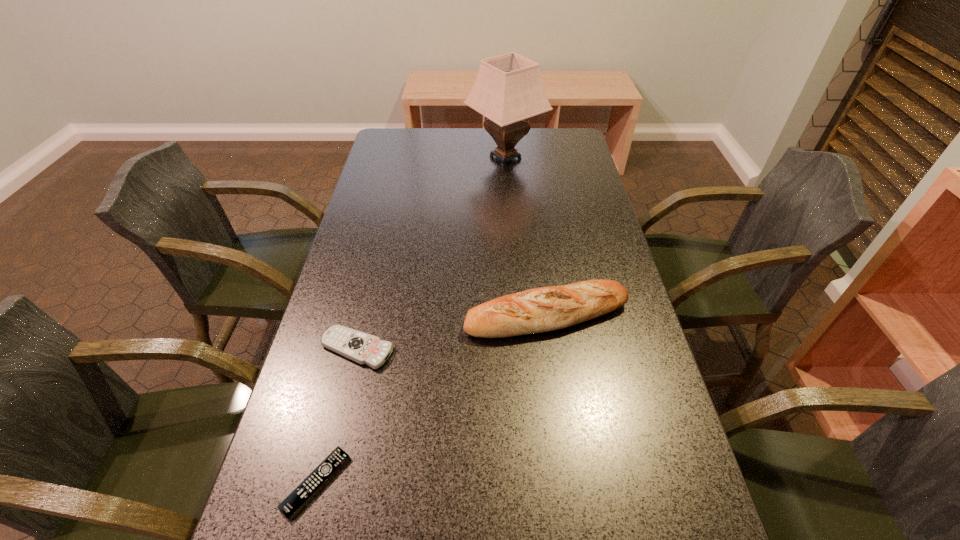
Find the location of a particular element. the farthest object is located at coordinates (508, 89).

Image resolution: width=960 pixels, height=540 pixels. Identify the location of the tallest object. (508, 89).

The height and width of the screenshot is (540, 960). Find the location of `baguet`. baguet is located at coordinates (537, 310).

You are a GUI agent. You are given a task and a screenshot of the screen. Output one action in this format:
    pyautogui.click(x=<x>, y=<y>)
    Task: Click on the second shortest object
    Image resolution: width=960 pixels, height=540 pixels.
    Given the screenshot: What is the action you would take?
    pyautogui.click(x=363, y=348)

Image resolution: width=960 pixels, height=540 pixels. What are the coordinates of `the taller remote control` in the screenshot? It's located at (363, 348).

Locate an element on the screen. The image size is (960, 540). the shortest object is located at coordinates (313, 483).

Locate an element on the screen. The width and height of the screenshot is (960, 540). the shorter remote control is located at coordinates (313, 483).

The height and width of the screenshot is (540, 960). In order to click on vacant region located 0.380m on the front of the lampshade in this screenshot , I will do `click(514, 255)`.

What are the coordinates of `free space located 0.290m on the left of the second tallest object` in the screenshot? It's located at (345, 315).

This screenshot has width=960, height=540. I want to click on free point located on the back of the farther remote control, so click(382, 245).